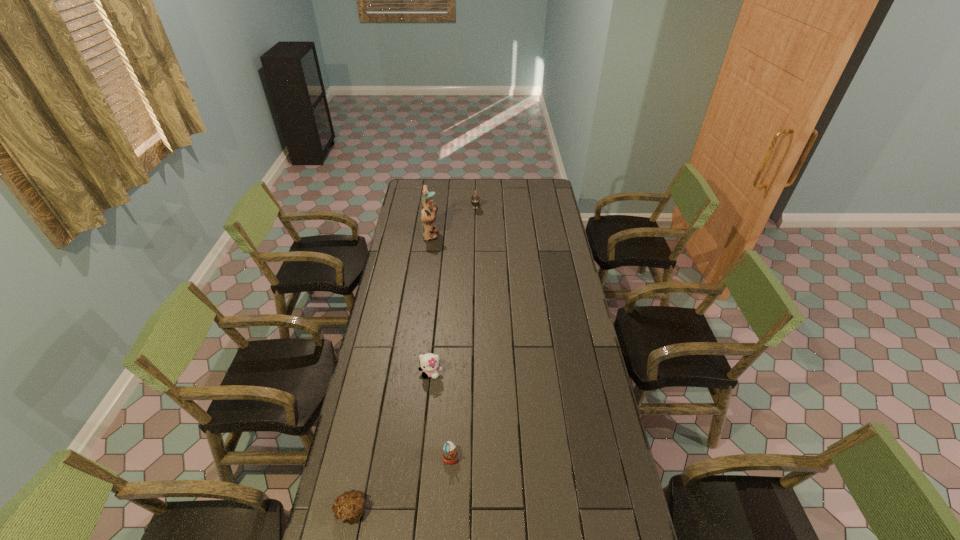
This screenshot has width=960, height=540. I want to click on vacant space at the far right corner, so click(555, 198).

At what (x,y) coordinates should I click in order to perform the action: click on unoccupied position between the second object from right to left and the figurine. Please return your answer as a coordinate pair (x, y). The height and width of the screenshot is (540, 960). Looking at the image, I should click on (441, 346).

The image size is (960, 540). Find the location of `vacant region between the third nearest object and the rightmost object`. vacant region between the third nearest object and the rightmost object is located at coordinates (453, 289).

Locate an element on the screen. This screenshot has height=540, width=960. vacant area that lies between the taller muffin and the farther kitten is located at coordinates (463, 331).

At what (x,y) coordinates should I click in order to perform the action: click on vacant space that's between the left kitten and the right kitten. Please return your answer as a coordinate pair (x, y). This screenshot has height=540, width=960. Looking at the image, I should click on (453, 289).

Locate an element on the screen. The width and height of the screenshot is (960, 540). vacant space that is in between the taller muffin and the figurine is located at coordinates (441, 346).

What are the coordinates of `vacant point located between the right kitten and the third nearest object` in the screenshot? It's located at (453, 289).

Where is `vacant area between the fourth tallest object and the right kitten`? The width and height of the screenshot is (960, 540). vacant area between the fourth tallest object and the right kitten is located at coordinates (463, 331).

Where is `unoccupied area between the rightmost object and the left kitten`? The width and height of the screenshot is (960, 540). unoccupied area between the rightmost object and the left kitten is located at coordinates (453, 289).

Where is `blank region between the shortest object and the second farthest object`? blank region between the shortest object and the second farthest object is located at coordinates (391, 373).